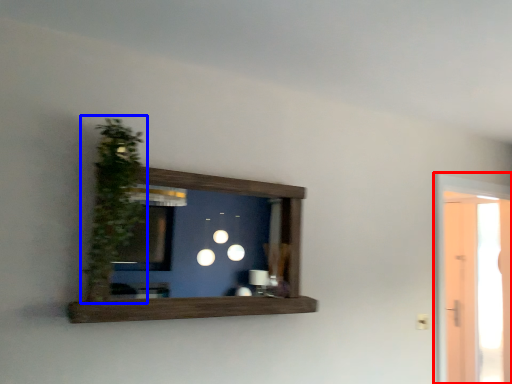
Question: Which object is closer to the camera taking this photo, glass door (highlighted by a red box) or plant (highlighted by a blue box)?

Choices:
 (A) glass door
 (B) plant

Answer: (B)